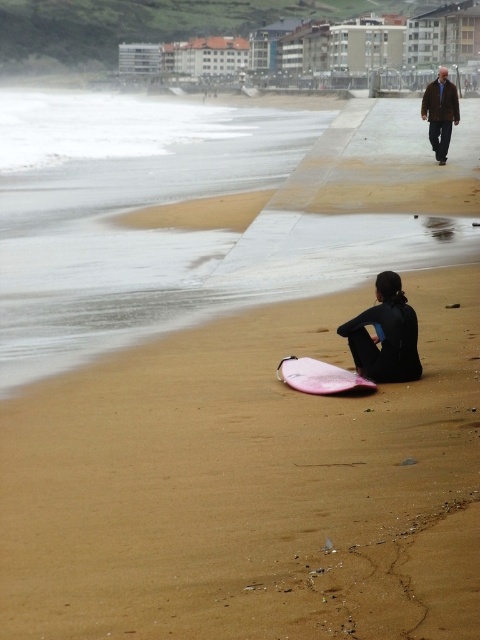
You are a photographer trying to capture a shot of the black matte wetsuit at lower center and the dark brown leather jacket at upper right. To ensure both are in frame, should you zoom in or zoom out?

You should zoom out because the black matte wetsuit at lower center is to the left of dark brown leather jacket at upper right, so zooming out will include both in the frame.